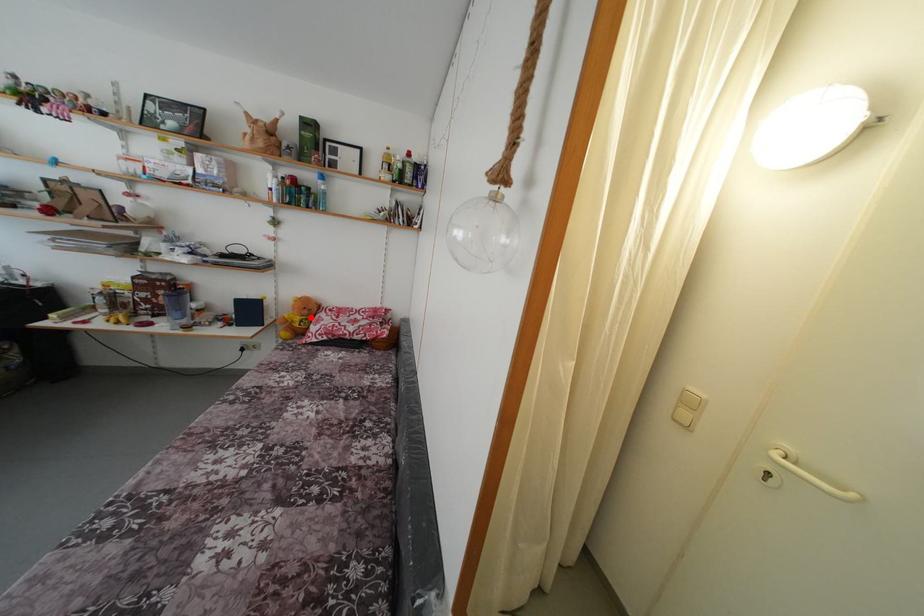
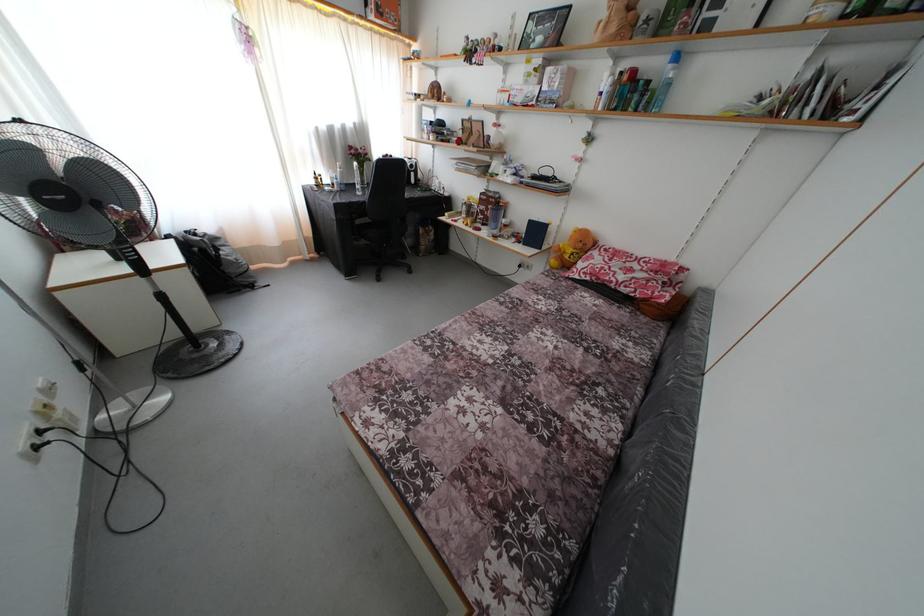
Question: I am providing you with two images of the same scene from different viewpoints. Given a red point in image1, look at the same physical point in image2. Is it:

Choices:
 (A) Closer to the viewpoint
 (B) Farther from the viewpoint

Answer: (A)